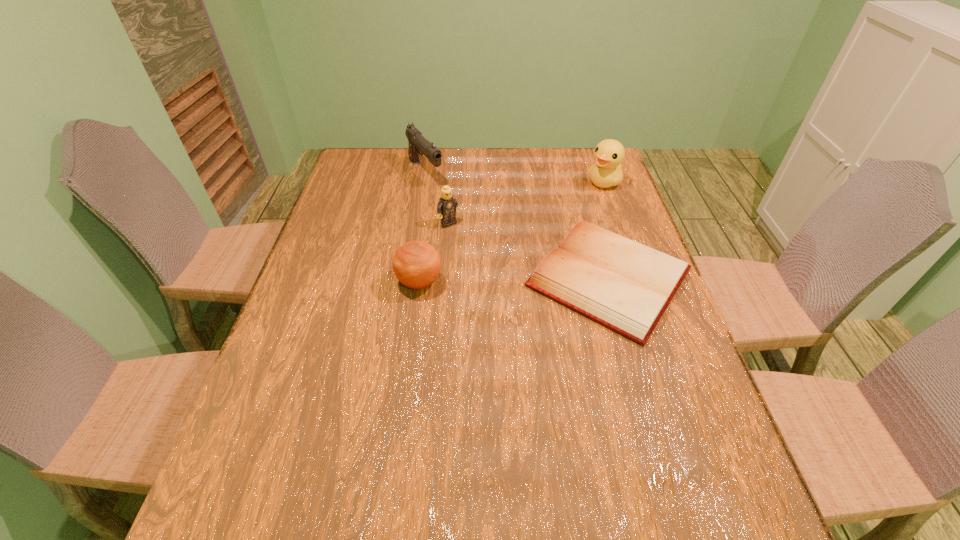
Find the location of a particular element. vacant area located 0.160m in front of the Lego is located at coordinates (486, 260).

Image resolution: width=960 pixels, height=540 pixels. I want to click on vacant space located 0.220m in front of the Lego, so click(x=498, y=273).

Where is `vacant area located 0.400m in front of the Lego`? vacant area located 0.400m in front of the Lego is located at coordinates (540, 316).

I want to click on vacant position located on the face of the duck, so click(x=560, y=222).

Identify the location of vacant space located on the face of the duck. This screenshot has width=960, height=540. (575, 208).

Locate an element on the screen. This screenshot has height=540, width=960. blank area located 0.150m on the face of the duck is located at coordinates (572, 211).

You are a GUI agent. You are given a task and a screenshot of the screen. Output one action in this format:
    pyautogui.click(x=<x>, y=<y>)
    Task: Click on the gun that is at the far edge
    This screenshot has width=960, height=540.
    Given the screenshot: What is the action you would take?
    pyautogui.click(x=418, y=144)

Find the location of a particular element. duck located in the far edge section of the desktop is located at coordinates (608, 154).

Image resolution: width=960 pixels, height=540 pixels. I want to click on Bible present at the right edge, so click(x=626, y=286).

You are a GUI agent. You are given a task and a screenshot of the screen. Output one action in this format:
    pyautogui.click(x=<x>, y=<y>)
    Task: Click on the duck that is positioned at the right edge
    
    Given the screenshot: What is the action you would take?
    pyautogui.click(x=608, y=154)